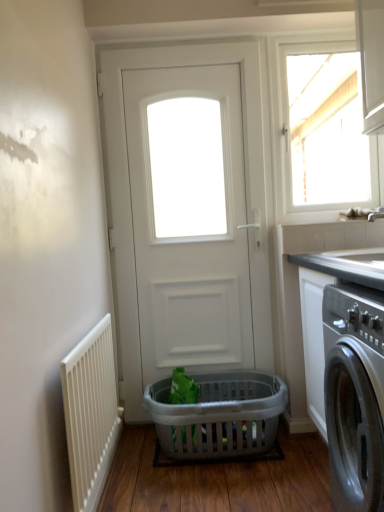
Locate an element on the screen. blank space situated above white matte door at center (from a real-world perspective) is located at coordinates [180, 45].